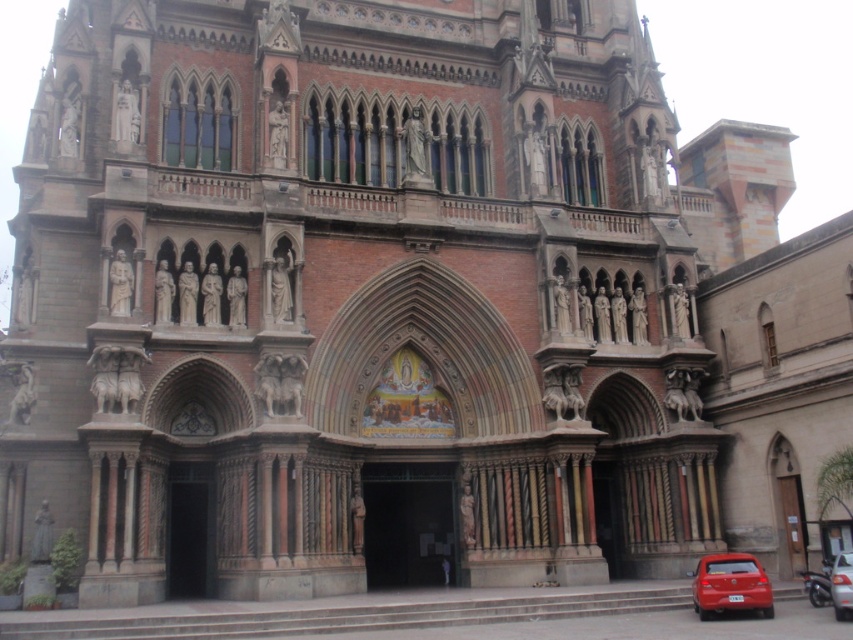
You are standing in front of the grand red brick church with a Gothic facade. You notice two points marked on the building. The first point is at coordinates point (757, 561) and the second is at point (839, 572). From your perspective, which point is closer to you?

Point (839, 572) is closer to you because the description states that point (757, 561) is behind point (839, 572).

You are a delivery person with a 2.5 meter wide truck. You need to park your truck between the shiny red car at lower right and the metallic silver car at lower right. Based on the scene, can your truck fit in the space between them?

The distance between the shiny red car at lower right and the metallic silver car at lower right is 5.04 meters. Since your truck is 2.5 meters wide, it can fit in the space between them as the available space is wider than the truck.